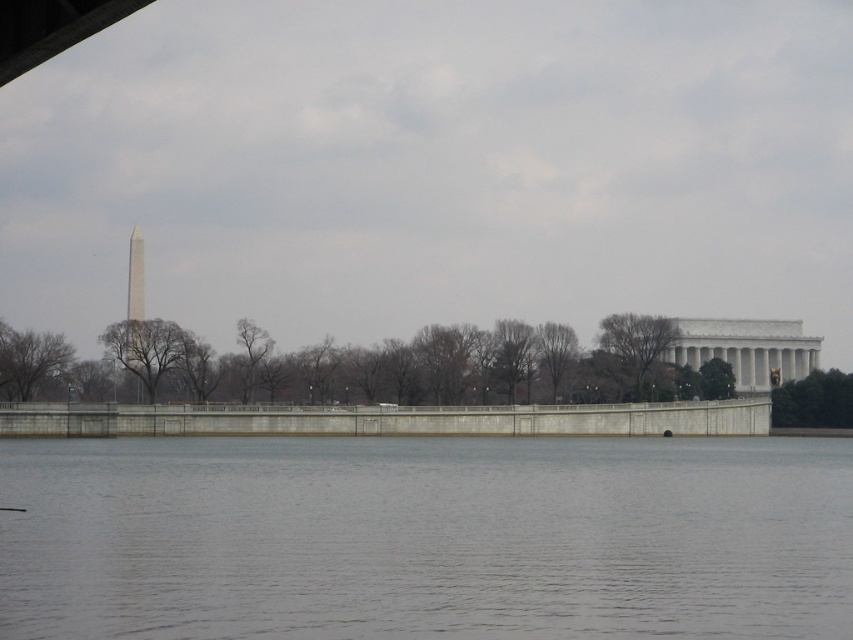
Question: Which of the following is the farthest from the observer?

Choices:
 (A) (352, 534)
 (B) (735, 404)

Answer: (B)

Question: Is gray concrete river at center closer to camera compared to concrete wall at center?

Choices:
 (A) no
 (B) yes

Answer: (B)

Question: Which object appears farthest from the camera in this image?

Choices:
 (A) concrete wall at center
 (B) gray concrete river at center

Answer: (A)

Question: Among these points, which one is nearest to the camera?

Choices:
 (A) pos(184,420)
 (B) pos(177,598)

Answer: (B)

Question: Is gray concrete river at center below concrete wall at center?

Choices:
 (A) yes
 (B) no

Answer: (B)

Question: Does gray concrete river at center have a lesser width compared to concrete wall at center?

Choices:
 (A) no
 (B) yes

Answer: (B)